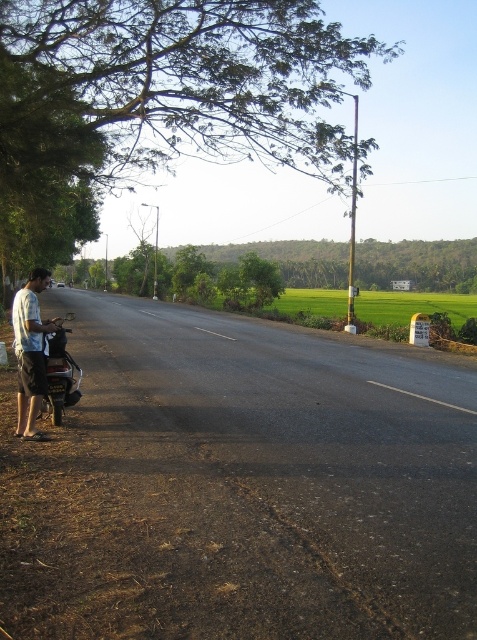
You are a pedestrian standing on the road and see the light blue cotton shirt at left and the metallic silver scooter at left. Which object is closer to you?

The light blue cotton shirt at left is closer to you because it is larger in size than the metallic silver scooter at left.

You are a delivery person who needs to place a 24 inch package between the light blue cotton shirt at left and the metallic silver scooter at left. Can you fit the package in the space between them?

The light blue cotton shirt at left is 27.07 inches away from the metallic silver scooter at left, so yes, the 24 inch package can fit between them since the distance is greater than the package length.